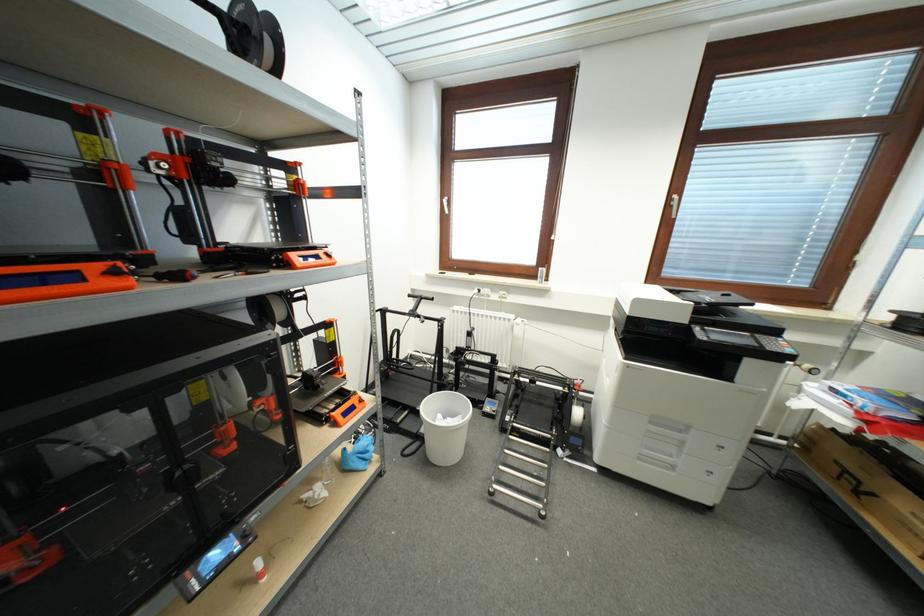
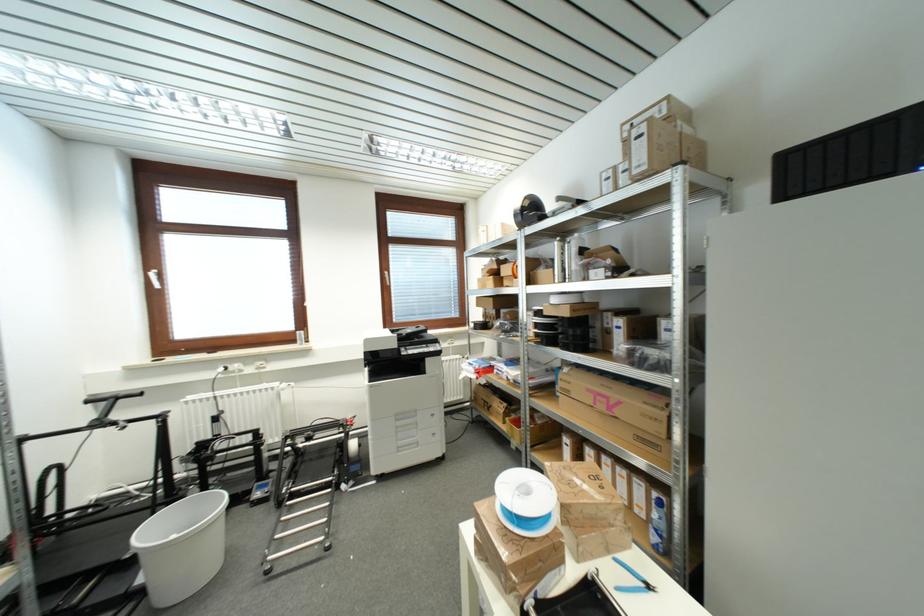
The point at (x=537, y=384) is marked in the first image. Where is the corresponding point in the second image?

(313, 440)